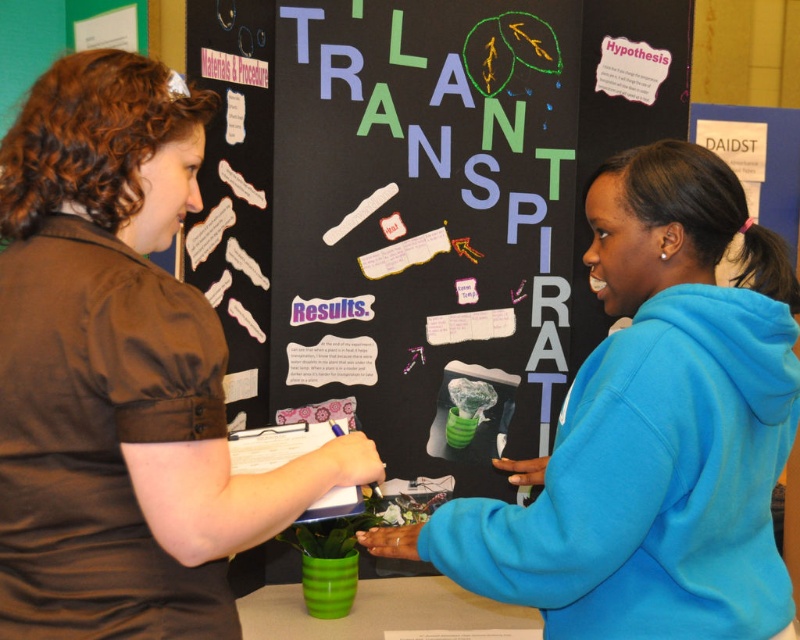
Question: Does blackboard at center have a greater width compared to blue fleece sweatshirt at right?

Choices:
 (A) yes
 (B) no

Answer: (A)

Question: Among these points, which one is nearest to the camera?

Choices:
 (A) (762, 524)
 (B) (114, 216)

Answer: (B)

Question: Estimate the real-world distances between objects in this image. Which object is closer to the brown fabric shirt at upper left?

Choices:
 (A) blackboard at center
 (B) blue fleece sweatshirt at right

Answer: (B)

Question: Does brown fabric shirt at upper left appear on the left side of blue fleece sweatshirt at right?

Choices:
 (A) no
 (B) yes

Answer: (B)

Question: Can you confirm if blackboard at center is positioned to the right of blue fleece sweatshirt at right?

Choices:
 (A) yes
 (B) no

Answer: (B)

Question: Which of these objects is positioned closest to the brown fabric shirt at upper left?

Choices:
 (A) blackboard at center
 (B) blue fleece sweatshirt at right

Answer: (B)